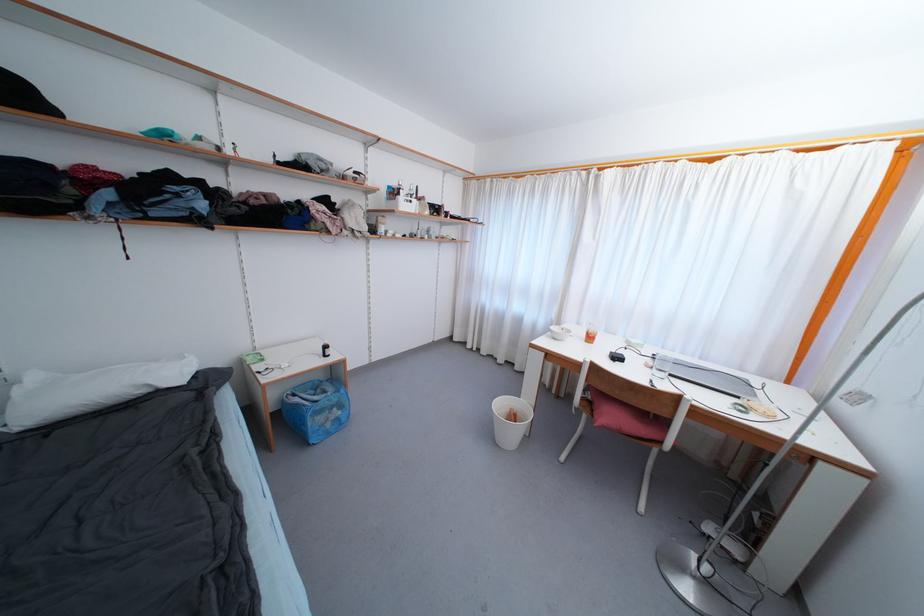
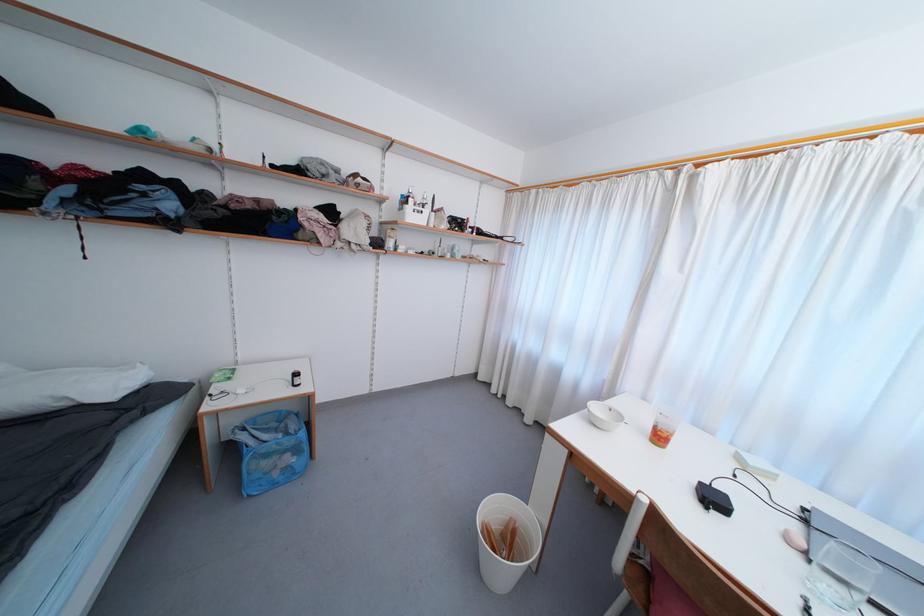
Question: The camera is either moving clockwise (left) or counter-clockwise (right) around the object. The first image is from the beginning of the video and the second image is from the end. Is the camera moving left or right when shooting the video?

Choices:
 (A) Left
 (B) Right

Answer: (B)